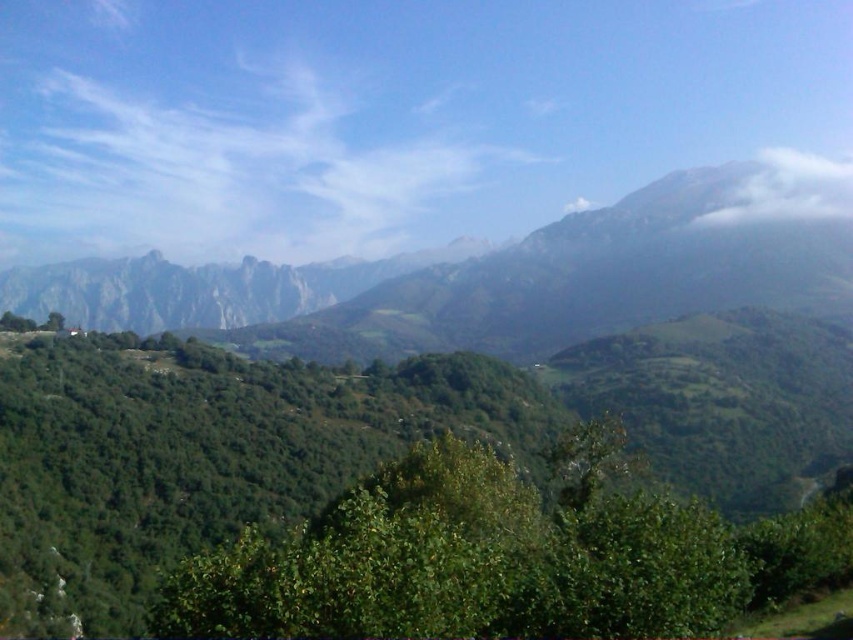
Between green grassy mountain range at upper center and white fluffy cloud at upper right, which one is positioned higher?

white fluffy cloud at upper right

Can you confirm if green grassy mountain range at upper center is positioned to the left of white fluffy cloud at upper right?

Yes, green grassy mountain range at upper center is to the left of white fluffy cloud at upper right.

At what (x,y) coordinates should I click in order to perform the action: click on green grassy mountain range at upper center. Please return your answer as a coordinate pair (x, y). The height and width of the screenshot is (640, 853). Looking at the image, I should click on (490, 278).